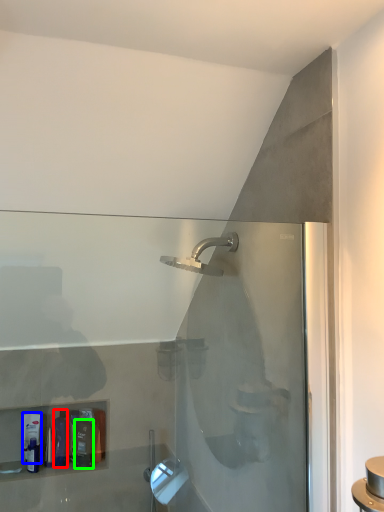
Question: Considering the real-world distances, which object is closest to toiletry (highlighted by a red box)? toiletry (highlighted by a blue box) or toiletry (highlighted by a green box).

Choices:
 (A) toiletry
 (B) toiletry

Answer: (B)